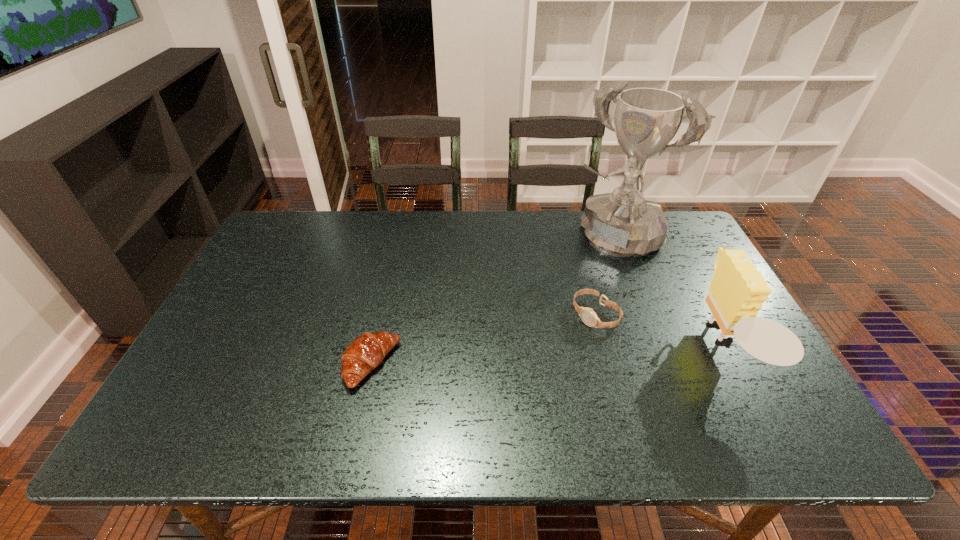
The image size is (960, 540). I want to click on unoccupied position between the crescent roll and the third shortest object, so click(546, 356).

You are a GUI agent. You are given a task and a screenshot of the screen. Output one action in this format:
    pyautogui.click(x=<x>, y=<y>)
    Task: Click on the free area in between the sponge and the farthest object
    
    Given the screenshot: What is the action you would take?
    pyautogui.click(x=666, y=292)

Locate an element on the screen. Image resolution: width=960 pixels, height=540 pixels. blank region between the award and the watch is located at coordinates (603, 275).

Image resolution: width=960 pixels, height=540 pixels. In order to click on free spot between the crescent roll and the farthest object in this screenshot , I will do `click(492, 300)`.

This screenshot has width=960, height=540. I want to click on object that is the third closest to the sponge, so click(x=366, y=352).

At what (x,y) coordinates should I click in order to perform the action: click on object that can be found as the third closest to the watch. Please return your answer as a coordinate pair (x, y). Image resolution: width=960 pixels, height=540 pixels. Looking at the image, I should click on (366, 352).

Where is `free point that satisfies the following two spatial constraints: 1. on the front side of the watch; 2. on the front-facing side of the second tallest object`? The image size is (960, 540). free point that satisfies the following two spatial constraints: 1. on the front side of the watch; 2. on the front-facing side of the second tallest object is located at coordinates (604, 347).

The image size is (960, 540). Find the location of `blank area in the image that satisfies the following two spatial constraints: 1. on the front side of the farthest object; 2. on the front-facing side of the sponge`. blank area in the image that satisfies the following two spatial constraints: 1. on the front side of the farthest object; 2. on the front-facing side of the sponge is located at coordinates (652, 347).

Locate an element on the screen. Image resolution: width=960 pixels, height=540 pixels. free space that satisfies the following two spatial constraints: 1. on the front side of the award; 2. on the front-facing side of the third shortest object is located at coordinates (652, 347).